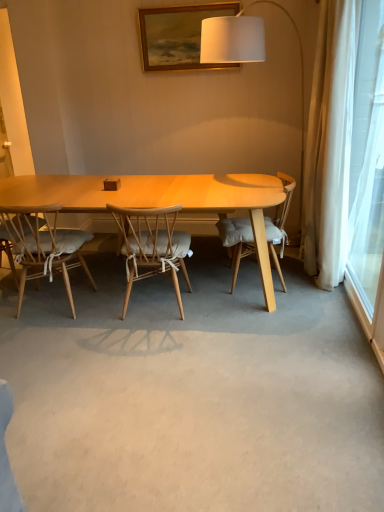
Image resolution: width=384 pixels, height=512 pixels. I want to click on vacant area that lies between natural wood chair with cushion at center, which is the 2th chair from right to left, and light wood chair with cushion at center, the 1th chair positioned from the right, so click(215, 300).